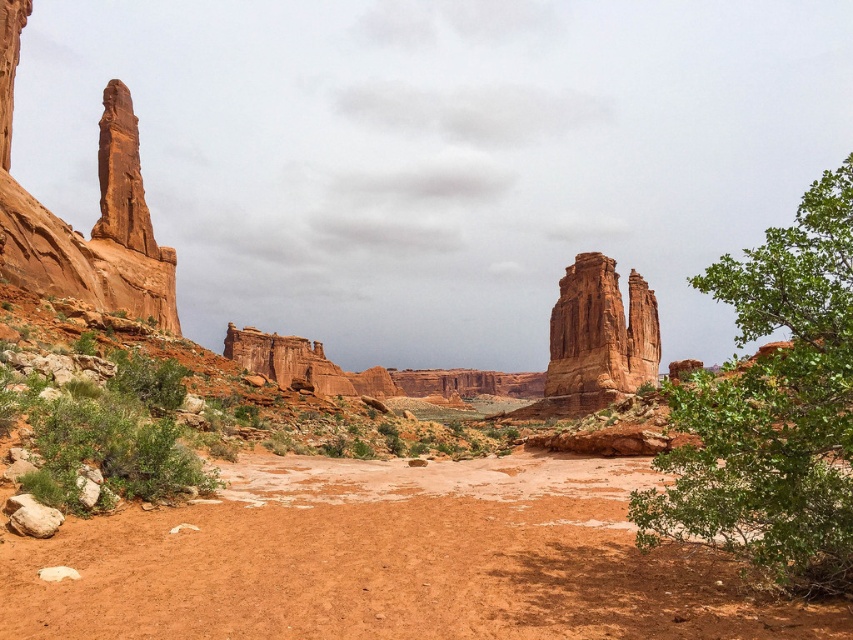
Question: Can you confirm if dusty red dirt track at center is positioned to the right of green leafy bush at lower left?

Choices:
 (A) no
 (B) yes

Answer: (B)

Question: Does green leafy tree at right appear on the right side of green leafy bush at lower left?

Choices:
 (A) no
 (B) yes

Answer: (B)

Question: Which is farther from the dusty red dirt track at center?

Choices:
 (A) green leafy bush at lower left
 (B) rustic sandstone rock formation at center
 (C) green leafy tree at right

Answer: (B)

Question: Based on their relative distances, which object is nearer to the rustic sandstone rock formation at center?

Choices:
 (A) dusty red dirt track at center
 (B) green leafy tree at right

Answer: (B)

Question: Is green leafy tree at right thinner than rustic sandstone rock formation at center?

Choices:
 (A) yes
 (B) no

Answer: (A)

Question: Among these points, which one is farthest from the camera?

Choices:
 (A) (834, 260)
 (B) (654, 349)
 (C) (343, 483)

Answer: (B)